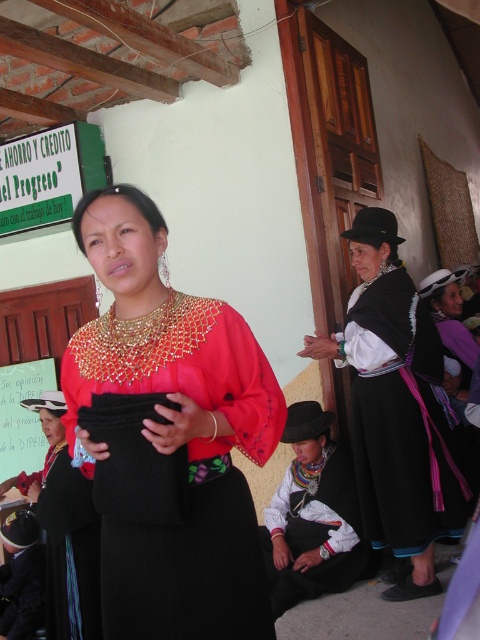
Does white woven fabric at lower center have a lesser height compared to matte black dress at center?

No.

Who is shorter, white woven fabric at lower center or matte black dress at center?

matte black dress at center is shorter.

Which is in front, point (288, 596) or point (49, 499)?

Point (49, 499) is in front.

You are a GUI agent. You are given a task and a screenshot of the screen. Output one action in this format:
    pyautogui.click(x=<x>, y=<y>)
    Task: Click on the white woven fabric at lower center
    The height and width of the screenshot is (640, 480).
    Given the screenshot: What is the action you would take?
    [314, 531]

Based on the photo, does black satin dress at center appear on the right side of matte black dress at center?

Yes, black satin dress at center is to the right of matte black dress at center.

Which is more to the left, black satin dress at center or matte black dress at center?

Positioned to the left is matte black dress at center.

Identify the location of black satin dress at center. (396, 406).

Find the location of `black satin dress at center`. black satin dress at center is located at coordinates pos(396,406).

Who is taller, black satin dress at center or white woven fabric at lower center?

Standing taller between the two is black satin dress at center.

Can you confirm if black satin dress at center is smaller than white woven fabric at lower center?

No.

Is point (416, 458) positioned behind point (330, 448)?

No, (416, 458) is closer to viewer.

Locate an element on the screen. The width and height of the screenshot is (480, 640). black satin dress at center is located at coordinates (396, 406).